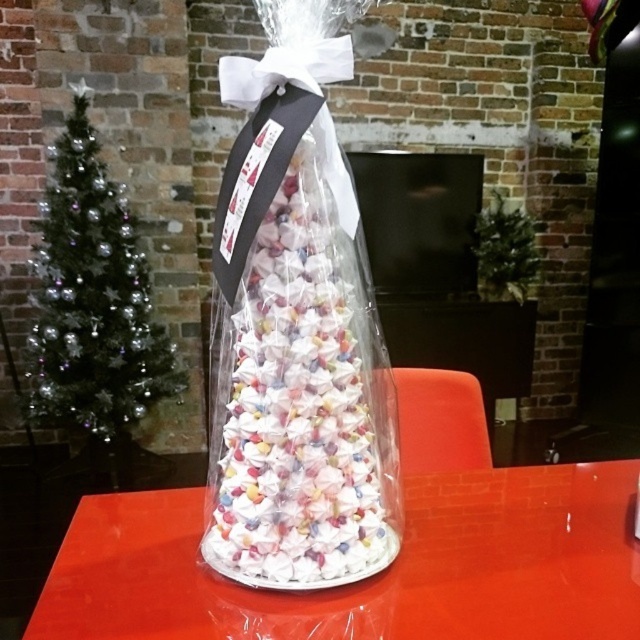
Question: Is translucent plastic table at center further to the viewer compared to translucent paper cone at center?

Choices:
 (A) no
 (B) yes

Answer: (A)

Question: Can you confirm if translucent plastic table at center is positioned to the right of translucent paper cone at center?

Choices:
 (A) no
 (B) yes

Answer: (B)

Question: Among these objects, which one is nearest to the camera?

Choices:
 (A) translucent paper cone at center
 (B) translucent plastic table at center

Answer: (B)

Question: Which of the following is the farthest from the observer?

Choices:
 (A) translucent paper cone at center
 (B) translucent plastic table at center

Answer: (A)

Question: Does translucent plastic table at center appear under translucent paper cone at center?

Choices:
 (A) yes
 (B) no

Answer: (A)